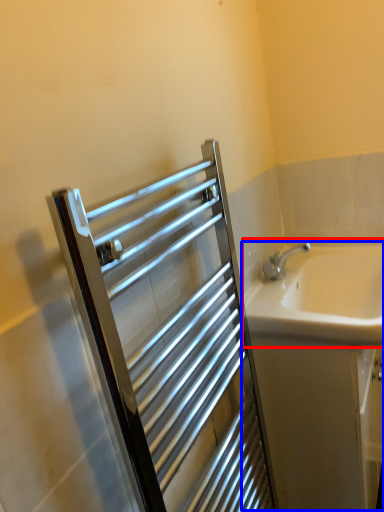
Question: Among these objects, which one is farthest to the camera, sink (highlighted by a red box) or bath (highlighted by a blue box)?

Choices:
 (A) sink
 (B) bath

Answer: (B)